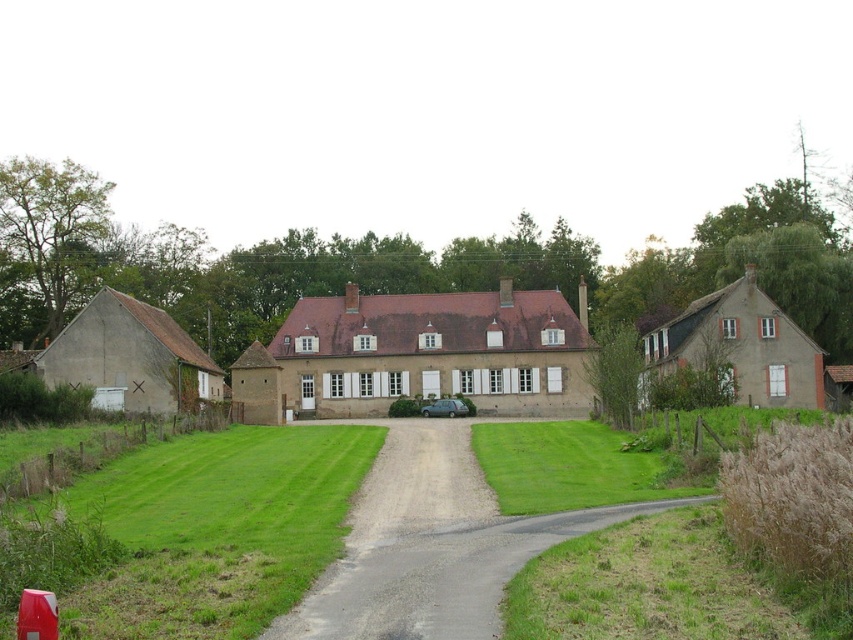
Image resolution: width=853 pixels, height=640 pixels. Describe the element at coordinates (215, 529) in the screenshot. I see `green grass at lower left` at that location.

Between point (198, 440) and point (407, 593), which one is positioned in front?

Point (407, 593)

Which is in front, point (183, 460) or point (473, 490)?

Point (473, 490) is in front.

Locate an element on the screen. The width and height of the screenshot is (853, 640). green grass at lower left is located at coordinates (215, 529).

Does green grass at lower left have a lesser width compared to metallic gray car at center?

In fact, green grass at lower left might be wider than metallic gray car at center.

Does green grass at lower left appear under metallic gray car at center?

No.

The image size is (853, 640). Identify the location of green grass at lower left. (215, 529).

Does dirt/gravel driveway at center appear under metallic gray car at center?

Incorrect, dirt/gravel driveway at center is not positioned below metallic gray car at center.

Does dirt/gravel driveway at center have a lesser width compared to metallic gray car at center?

No, dirt/gravel driveway at center is not thinner than metallic gray car at center.

Between point (390, 572) and point (430, 403), which one is positioned behind?

Positioned behind is point (430, 403).

Identify the location of dirt/gravel driveway at center. Image resolution: width=853 pixels, height=640 pixels. (431, 544).